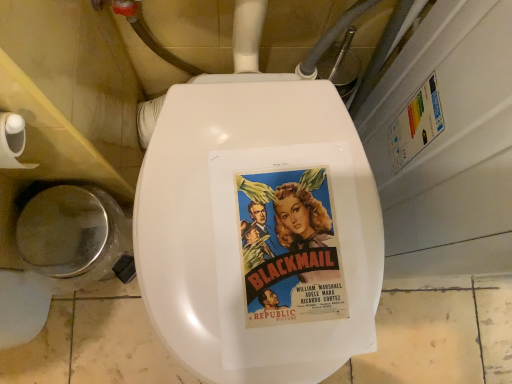
Question: Does white matte toilet paper at left have a lesser height compared to shiny silver lid at lower left?

Choices:
 (A) no
 (B) yes

Answer: (B)

Question: Does white matte toilet paper at left have a larger size compared to shiny silver lid at lower left?

Choices:
 (A) yes
 (B) no

Answer: (B)

Question: Is the surface of white matte toilet paper at left in direct contact with shiny silver lid at lower left?

Choices:
 (A) yes
 (B) no

Answer: (B)

Question: Can we say white matte toilet paper at left lies outside shiny silver lid at lower left?

Choices:
 (A) yes
 (B) no

Answer: (A)

Question: Does white matte toilet paper at left have a greater height compared to shiny silver lid at lower left?

Choices:
 (A) no
 (B) yes

Answer: (A)

Question: From the image's perspective, is white matte toilet paper at left under shiny silver lid at lower left?

Choices:
 (A) no
 (B) yes

Answer: (A)

Question: Is vintage paper poster at center thinner than shiny silver lid at lower left?

Choices:
 (A) no
 (B) yes

Answer: (A)

Question: Can you confirm if vintage paper poster at center is wider than shiny silver lid at lower left?

Choices:
 (A) no
 (B) yes

Answer: (B)

Question: Is the position of vintage paper poster at center less distant than that of shiny silver lid at lower left?

Choices:
 (A) yes
 (B) no

Answer: (A)

Question: Is vintage paper poster at center not near shiny silver lid at lower left?

Choices:
 (A) no
 (B) yes

Answer: (A)

Question: Is shiny silver lid at lower left located within vintage paper poster at center?

Choices:
 (A) no
 (B) yes

Answer: (A)

Question: From the image's perspective, is vintage paper poster at center located above shiny silver lid at lower left?

Choices:
 (A) no
 (B) yes

Answer: (B)

Question: From the image's perspective, is shiny silver lid at lower left beneath vintage paper poster at center?

Choices:
 (A) no
 (B) yes

Answer: (B)